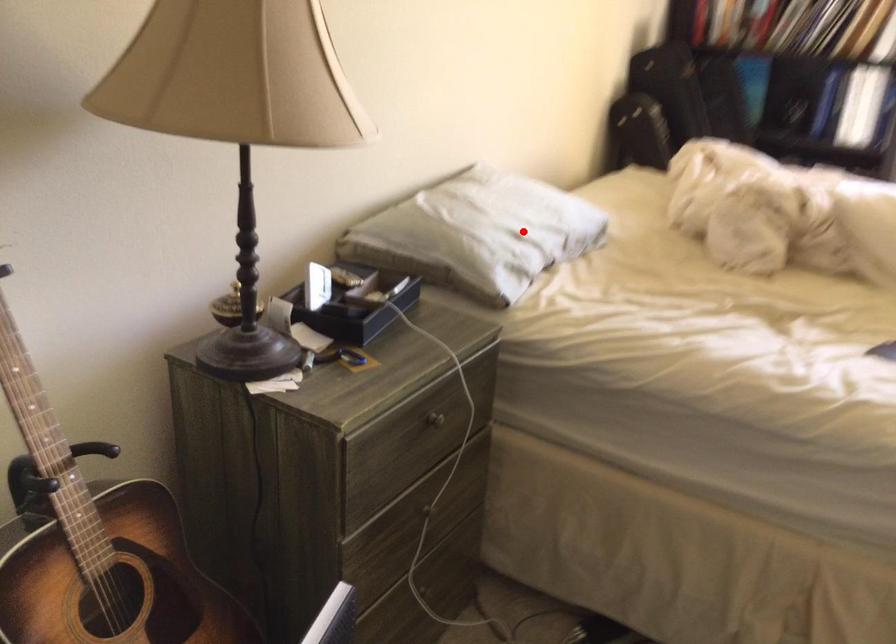
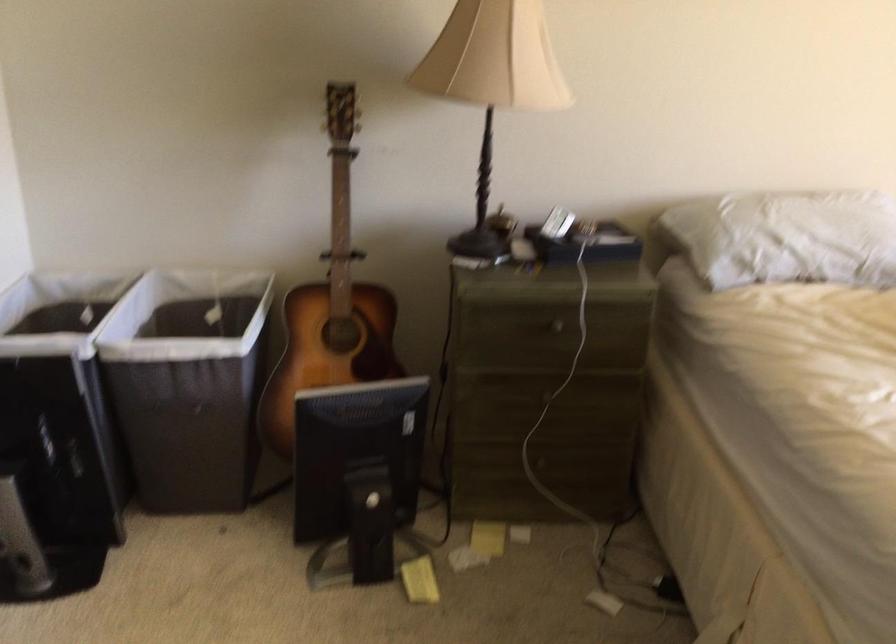
Locate, in the second image, the point that corresponds to the highlighted location in the first image.

(786, 237)